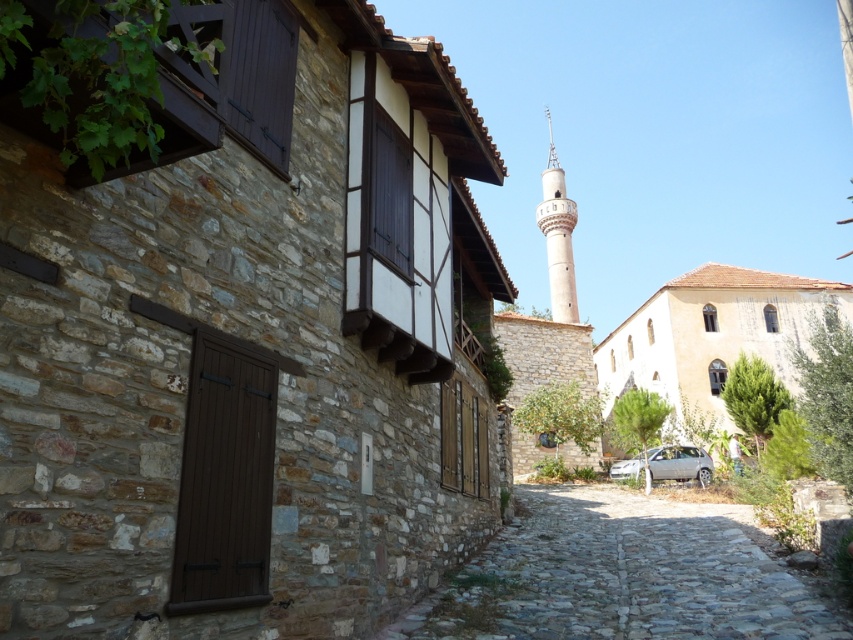
Between point (492, 614) and point (662, 467), which one is positioned behind?

The point (662, 467) is more distant.

Who is more forward, [762,573] or [637,474]?

Point [762,573] is more forward.

This screenshot has width=853, height=640. What are the coordinates of `cobblestone path at center` in the screenshot? It's located at (624, 576).

Is cobblestone path at center wider than smooth white minaret at center?

Incorrect, cobblestone path at center's width does not surpass smooth white minaret at center's.

Between cobblestone path at center and smooth white minaret at center, which one is positioned higher?

smooth white minaret at center is above.

In order to click on cobblestone path at center in this screenshot , I will do `click(624, 576)`.

Is smooth white minaret at center to the right of silver metallic car at lower center from the viewer's perspective?

Yes, smooth white minaret at center is to the right of silver metallic car at lower center.

Is point (549, 208) in front of point (660, 460)?

No.

What do you see at coordinates (556, 236) in the screenshot? The width and height of the screenshot is (853, 640). I see `smooth white minaret at center` at bounding box center [556, 236].

Image resolution: width=853 pixels, height=640 pixels. I want to click on smooth white minaret at center, so click(x=556, y=236).